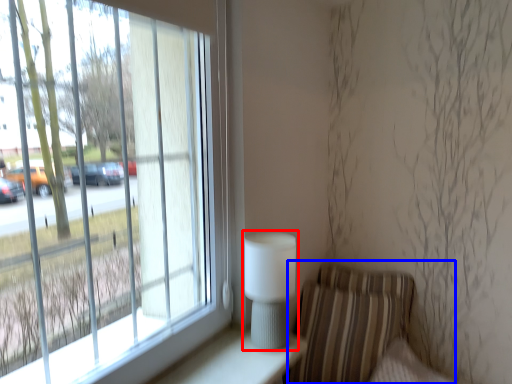
Question: Which object appears closest to the camera in this image, table lamp (highlighted by a red box) or armchair (highlighted by a blue box)?

Choices:
 (A) table lamp
 (B) armchair

Answer: (A)